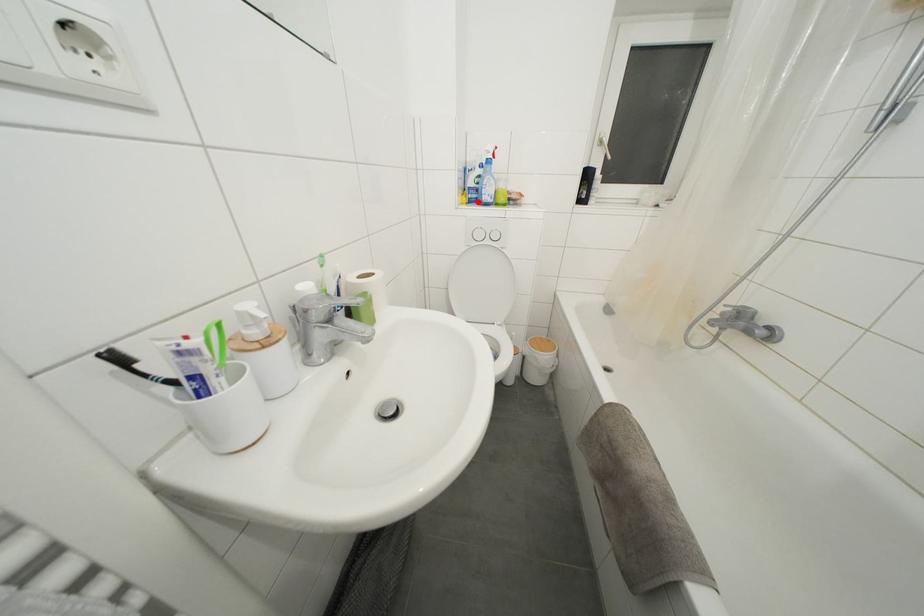
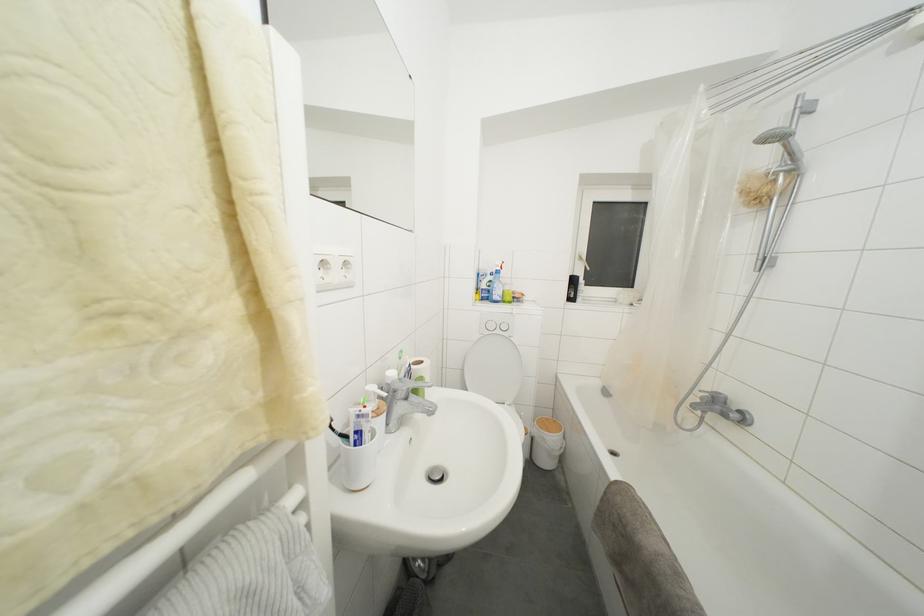
Question: I am providing you with two images of the same scene from different viewpoints. A red point is marked on the first image. Is the red point's position out of view in image 2?

Choices:
 (A) Yes
 (B) No

Answer: (B)